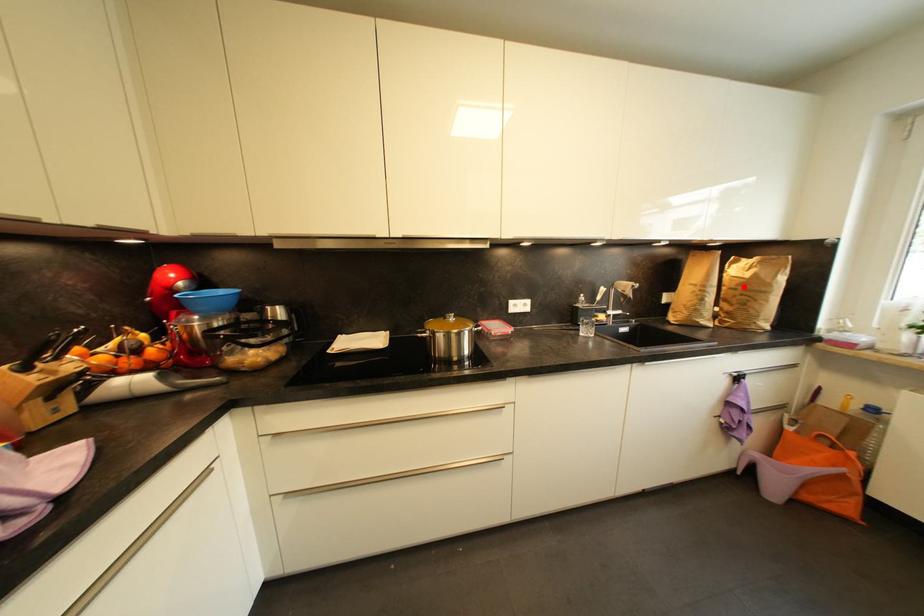
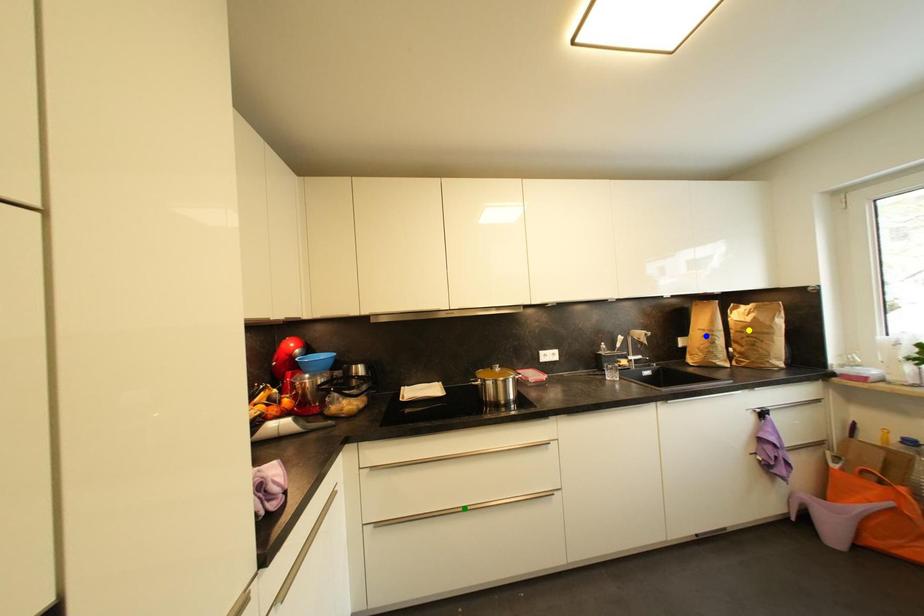
Question: I am providing you with two images of the same scene from different viewpoints. A red point is marked on the first image. You are given multiple points on the second image. Can you choose the point in image 2 that corresponds to the point in image 1?

Choices:
 (A) green point
 (B) yellow point
 (C) blue point

Answer: (B)